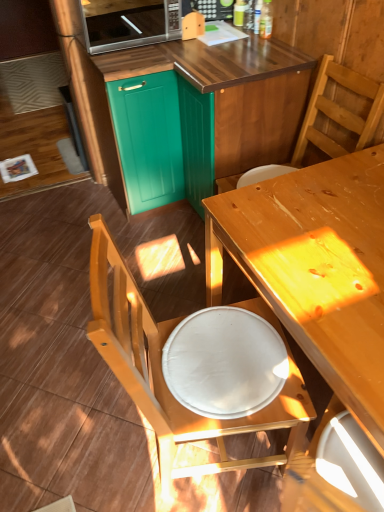
The height and width of the screenshot is (512, 384). What are the coordinates of `free point above teal wood cabinet at upper center, marked as the 1th cabinetry in a right-to-left arrangement (from a real-world perspective)` in the screenshot? It's located at (193, 40).